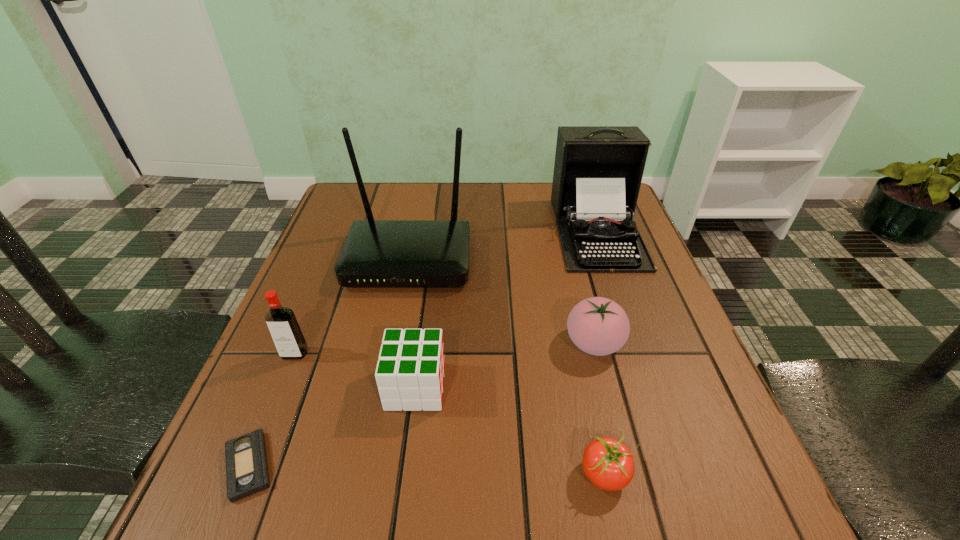
Image resolution: width=960 pixels, height=540 pixels. What are the coordinates of `videotape that is at the left edge` in the screenshot? It's located at (247, 473).

Where is `typewriter that is at the right edge`? The width and height of the screenshot is (960, 540). typewriter that is at the right edge is located at coordinates (598, 170).

Find the location of `tomato present at the right edge`. tomato present at the right edge is located at coordinates pyautogui.click(x=598, y=326).

What are the coordinates of `object that is positioned at the near left corner` in the screenshot? It's located at (247, 473).

Where is `object located at the far right corner`? object located at the far right corner is located at coordinates (598, 170).

In the image, there is a desktop. At what (x,y) coordinates should I click in order to perform the action: click on free region at the far edge. Please return your answer as a coordinate pair (x, y). The width and height of the screenshot is (960, 540). Looking at the image, I should click on (419, 213).

Identify the location of vacant space at the near edge. The width and height of the screenshot is (960, 540). (548, 505).

Where is `free space at the left edge`? free space at the left edge is located at coordinates (317, 352).

The image size is (960, 540). I want to click on vacant area between the vodka and the farther tomato, so click(444, 348).

Locate an element on the screen. The height and width of the screenshot is (540, 960). free space that is in between the router and the videotape is located at coordinates (329, 363).